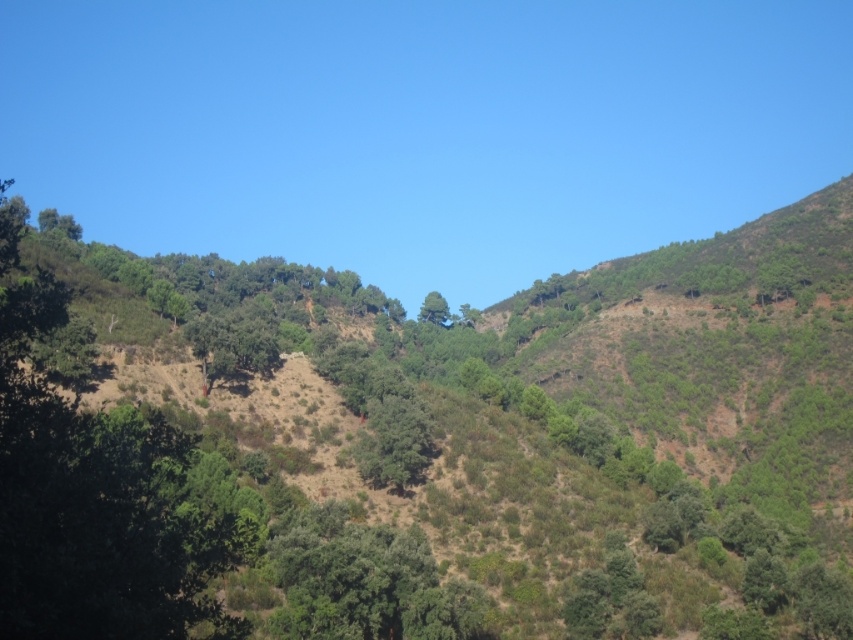
Can you confirm if green leafy tree at center is shorter than green matte tree at center?

No, green leafy tree at center is not shorter than green matte tree at center.

Between green leafy tree at center and green matte tree at center, which one has less height?

green matte tree at center

Which is behind, point (341, 392) or point (439, 296)?

Positioned behind is point (439, 296).

This screenshot has height=640, width=853. What are the coordinates of `green leafy tree at center` in the screenshot? It's located at (432, 448).